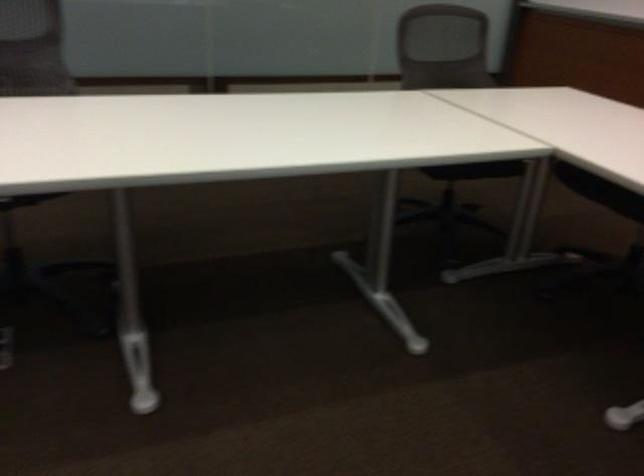
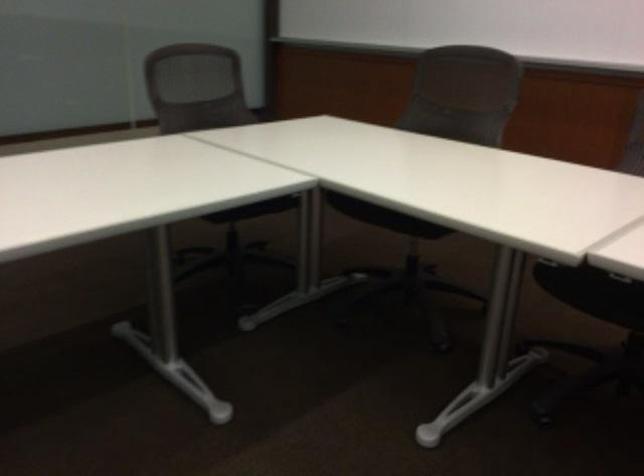
Where in the second image is the point corresponding to [477,169] from the first image?

(254, 209)